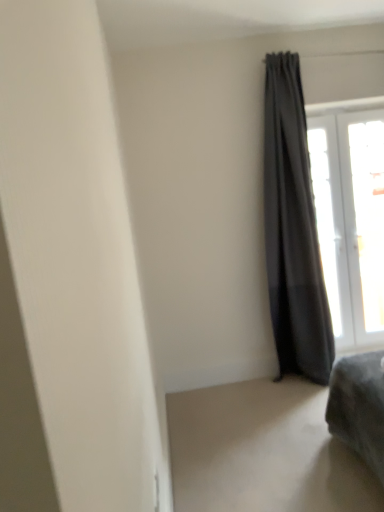
At what (x,y) coordinates should I click in order to perform the action: click on free space to the left of dark gray fabric curtain at right. Please return your answer as a coordinate pair (x, y). This screenshot has width=384, height=512. Looking at the image, I should click on (259, 394).